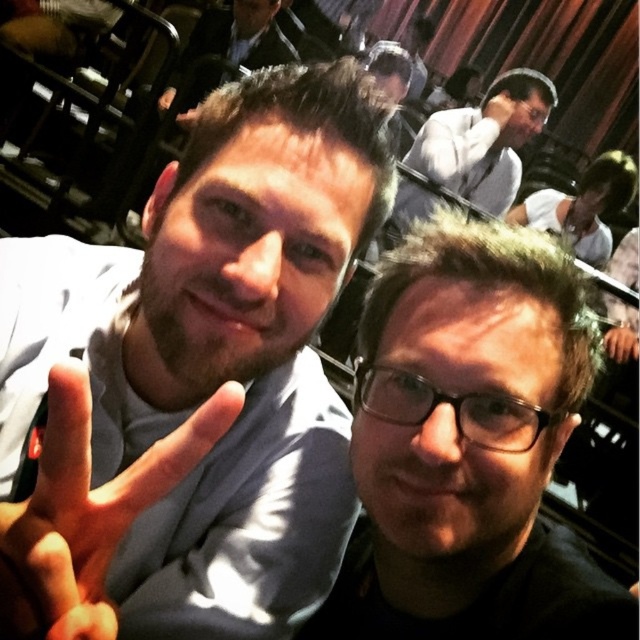
You are a photographer at an event and need to adjust the lighting so that the dark gray suit at upper center and the matte black hand at lower right are both clearly visible. Which object should you focus on first to ensure proper exposure, considering their positions?

The dark gray suit at upper center should be focused on first because it is positioned to the left of the matte black hand at lower right, making it closer to the main light source.